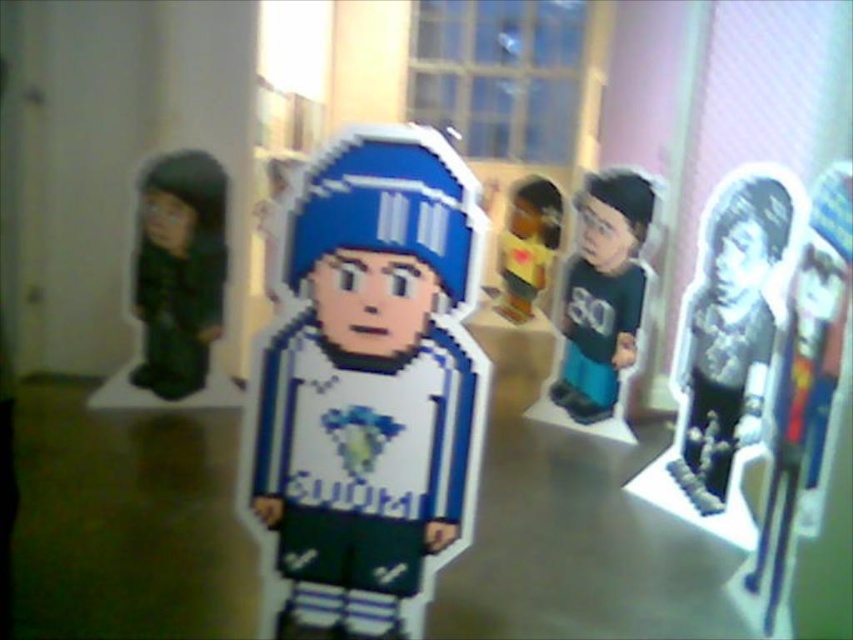
You are a visitor at the exhibition and want to take a photo of both the pixelated blue and white figure at center and the matte green jersey at center. Which one should you focus on first if you want to capture both in the same frame without moving your camera?

You should focus on the pixelated blue and white figure at center first because it is located below the matte green jersey at center, so adjusting the camera to include both would require framing from the bottom up.

You are an art curator trying to arrange these two items in a display case. The display case has a width limit of 1 meter. The pixelated blue and white figure at center and the matte black doll at left need to be placed side by side. Can both fit without exceeding the case width?

The pixelated blue and white figure at center is wider than the matte black doll at left. However, since the exact widths are not provided, we cannot determine if their combined width exceeds 1 meter. More information is needed.